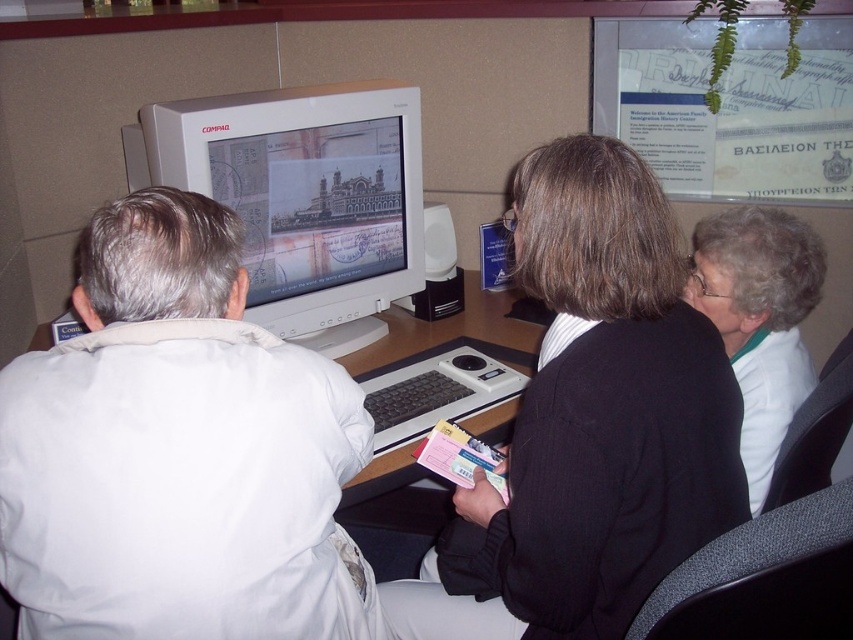
Question: Which point appears closest to the camera in this image?

Choices:
 (A) (224, 145)
 (B) (746, 460)
 (C) (466, 282)

Answer: (B)

Question: Does white matte jacket at left come in front of white fabric at right?

Choices:
 (A) no
 (B) yes

Answer: (B)

Question: Is white matte computer monitor at center positioned in front of wooden desk at center?

Choices:
 (A) yes
 (B) no

Answer: (B)

Question: Does white matte jacket at left lie behind dark brown sweater at center?

Choices:
 (A) yes
 (B) no

Answer: (B)

Question: Estimate the real-world distances between objects in this image. Which object is closer to the white matte jacket at left?

Choices:
 (A) wooden desk at center
 (B) dark brown sweater at center
 (C) white fabric at right
 (D) white matte computer monitor at center

Answer: (B)

Question: Considering the real-world distances, which object is farthest from the dark brown sweater at center?

Choices:
 (A) white matte jacket at left
 (B) white matte computer monitor at center

Answer: (B)